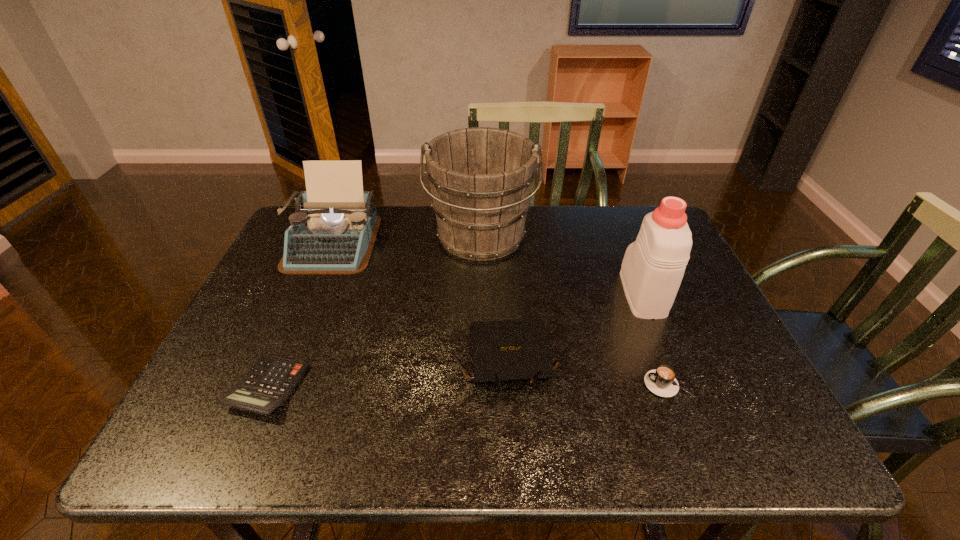
The image size is (960, 540). In order to click on calculator that is at the left edge in this screenshot , I will do `click(268, 384)`.

Locate an element on the screen. The width and height of the screenshot is (960, 540). detergent positioned at the right edge is located at coordinates (653, 266).

Locate an element on the screen. The width and height of the screenshot is (960, 540). cappuccino that is at the right edge is located at coordinates (661, 381).

Locate an element on the screen. object positioned at the far left corner is located at coordinates (333, 231).

Where is `object at the near left corner`? The height and width of the screenshot is (540, 960). object at the near left corner is located at coordinates (268, 384).

This screenshot has width=960, height=540. Identify the location of vacant space at the far edge of the desktop. (547, 220).

This screenshot has height=540, width=960. In the image, there is a desktop. What are the coordinates of `free space at the near edge` in the screenshot? It's located at (624, 440).

Where is `vacant space at the left edge`? vacant space at the left edge is located at coordinates (280, 320).

You are a GUI agent. You are given a task and a screenshot of the screen. Output one action in this format:
    pyautogui.click(x=<x>, y=<y>)
    Task: Click on the vacant space at the near right corner of the desktop
    
    Given the screenshot: What is the action you would take?
    pyautogui.click(x=770, y=440)

Locate an element on the screen. This screenshot has height=540, width=960. empty space that is in between the fourth tallest object and the detergent is located at coordinates (576, 327).